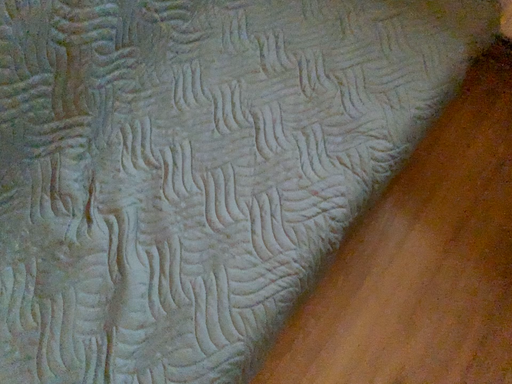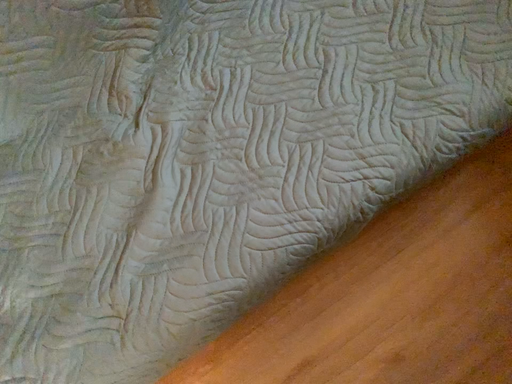
Question: Which way did the camera rotate in the video?

Choices:
 (A) rotated upward
 (B) rotated downward

Answer: (B)